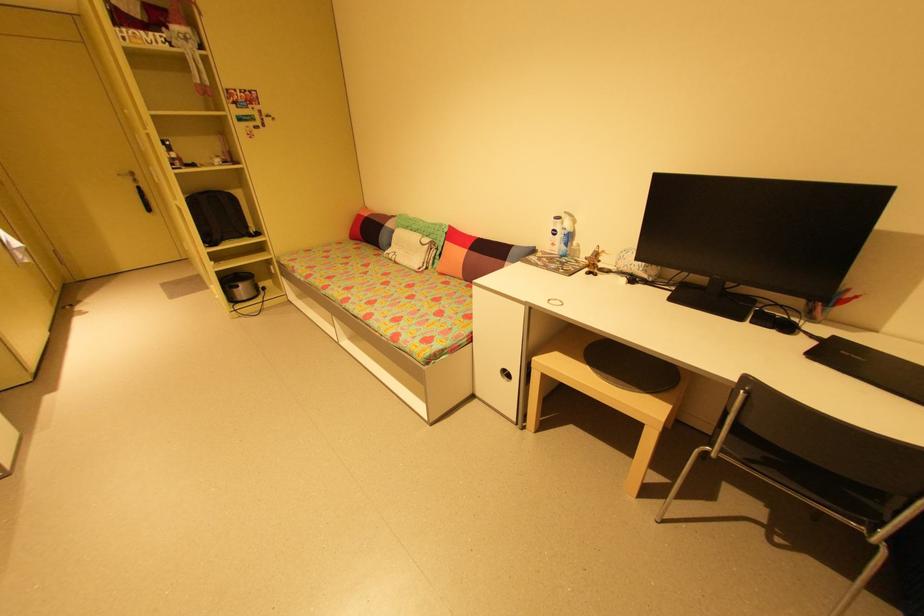
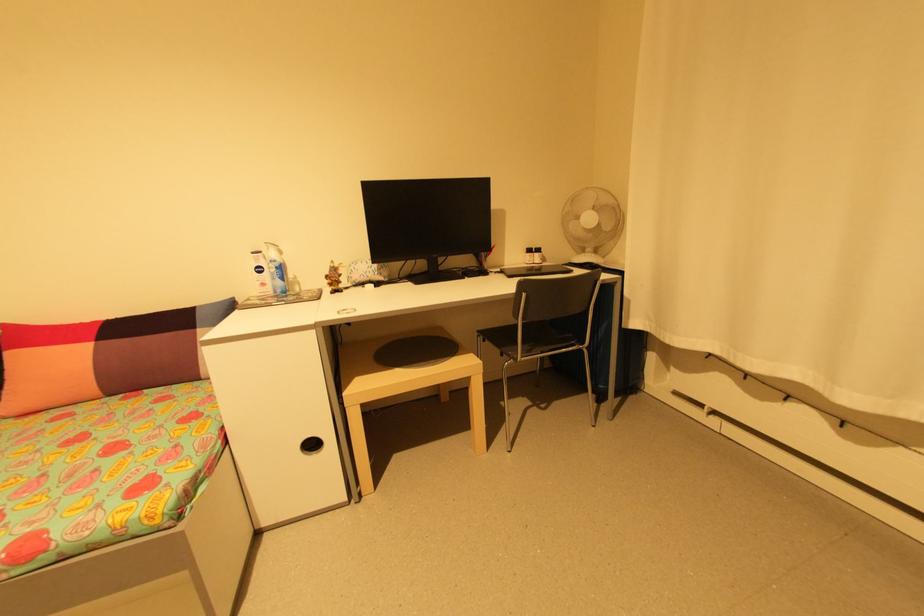
Where in the second image is the point corresponding to [512,375] from the first image?

(317, 446)